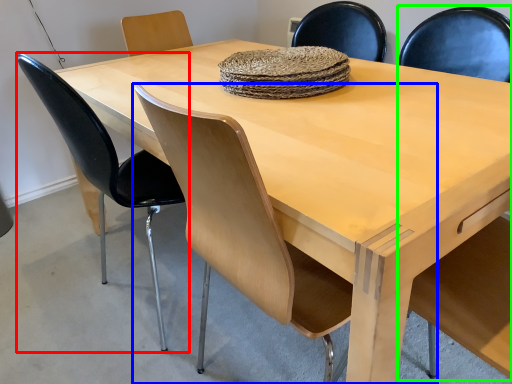
Question: Estimate the real-world distances between objects in this image. Which object is closer to chair (highlighted by a red box), chair (highlighted by a blue box) or armchair (highlighted by a green box)?

Choices:
 (A) chair
 (B) armchair

Answer: (A)